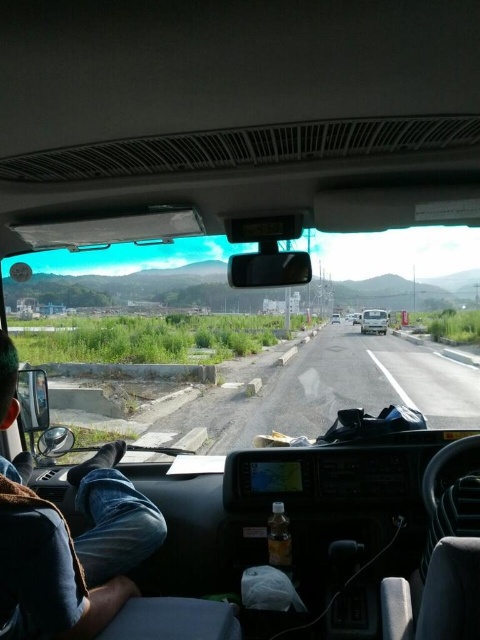
Who is positioned more to the right, jeans at lower left or white glossy car at center?

white glossy car at center

Does jeans at lower left appear under white glossy car at center?

Correct, jeans at lower left is located below white glossy car at center.

Who is more distant from viewer, (101, 592) or (336, 321)?

Point (336, 321)

What are the coordinates of `jeans at lower left` in the screenshot? It's located at (72, 552).

Which is behind, point (383, 324) or point (337, 321)?

Point (337, 321)

Consider the image. Is white matte van at center behind white glossy car at center?

No, white matte van at center is in front of white glossy car at center.

Find the location of a particular element. This screenshot has height=640, width=480. white matte van at center is located at coordinates (373, 321).

Is point (106, 573) closer to viewer compared to point (287, 401)?

Yes, point (106, 573) is in front of point (287, 401).

Which is more to the left, jeans at lower left or gravel road at center?

Positioned to the left is jeans at lower left.

Is point (14, 401) closer to camera compared to point (295, 365)?

Yes, it is in front of point (295, 365).

Where is `jeans at lower left`? This screenshot has width=480, height=640. jeans at lower left is located at coordinates (72, 552).